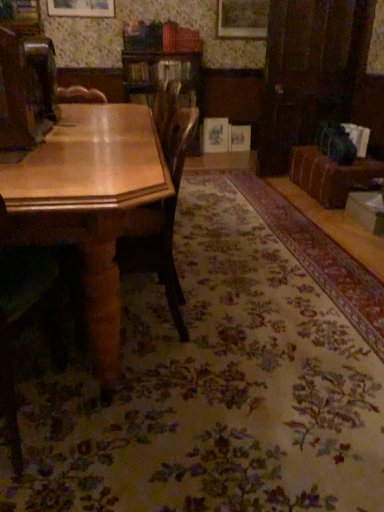
At what (x,y) coordinates should I click in order to perform the action: click on vacant area located to the right-hand side of wooden chair at center, which is the second chair from left to right. Please return your answer as a coordinate pair (x, y). Looking at the image, I should click on (242, 322).